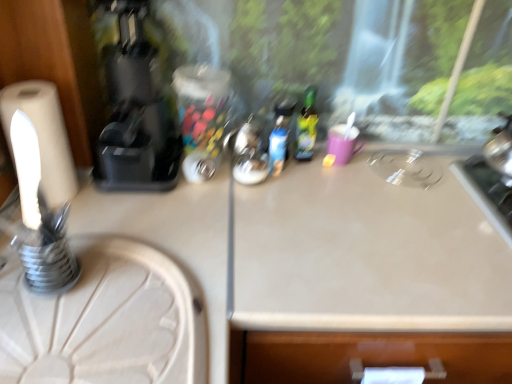
Identify the location of vacant space in front of green glass bottle at center, the second bottle positioned from the left. (310, 193).